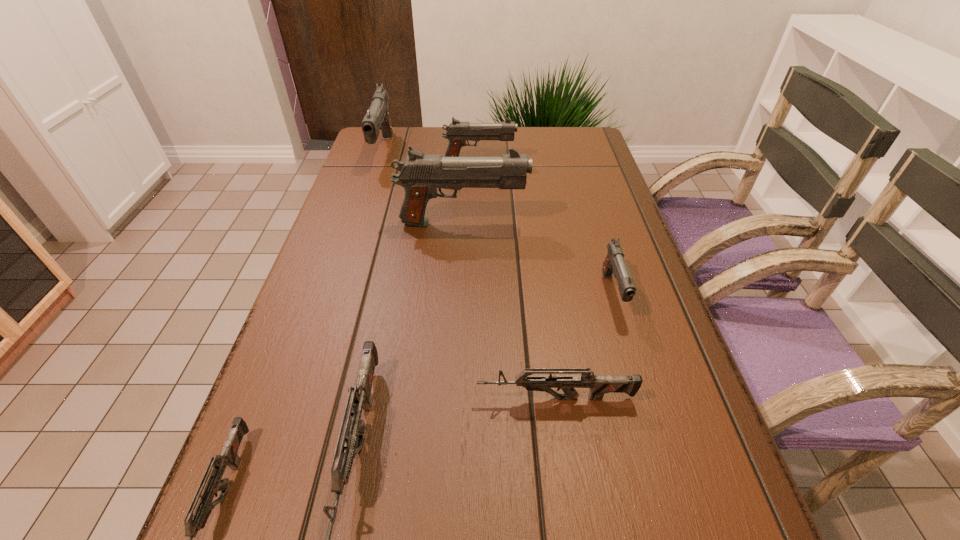
Identify the location of gray gun that is the third closest one to the third tallest object. (614, 263).

The height and width of the screenshot is (540, 960). Identify the location of grey gun that is the nearest to the shortest gun. (353, 428).

The image size is (960, 540). I want to click on grey gun that is the second closest one to the second grey gun from right to left, so click(x=599, y=385).

Locate an element on the screen. blank area in the image that satisfies the following two spatial constraints: 1. in the direction the nearest gray gun is aimed; 2. aimed along the barrel of the second shortest object is located at coordinates (644, 399).

I want to click on free space in the image that satisfies the following two spatial constraints: 1. in the direction the rightmost gray gun is aimed; 2. aimed along the barrel of the rightmost grey gun, so 644,399.

The height and width of the screenshot is (540, 960). I want to click on free spot that satisfies the following two spatial constraints: 1. in the direction the rightmost gun is aimed; 2. aimed along the barrel of the second biggest grey gun, so click(x=644, y=399).